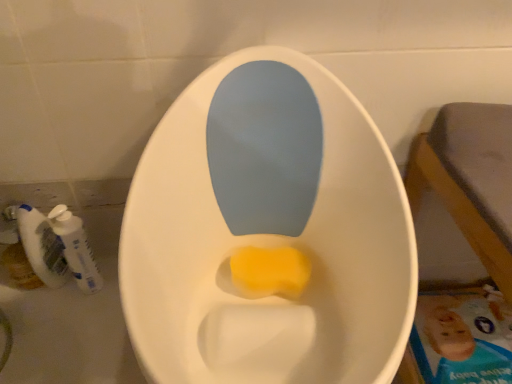
Question: Based on their sizes in the image, would you say white plastic mouthwash at left, the 2th mouthwash when ordered from left to right, is bigger or smaller than yellow sponge at center?

Choices:
 (A) small
 (B) big

Answer: (B)

Question: In the image, is white plastic mouthwash at left, the 2th mouthwash when ordered from left to right, on the left side or the right side of yellow sponge at center?

Choices:
 (A) right
 (B) left

Answer: (B)

Question: Which is nearer to the yellow sponge at center?

Choices:
 (A) white plastic mouthwash at left, which is counted as the first mouthwash, starting from the right
 (B) white plastic mouthwash at lower left, which is counted as the first mouthwash, starting from the left

Answer: (A)

Question: Considering the real-world distances, which object is farthest from the white plastic mouthwash at lower left, which appears as the second mouthwash when viewed from the right?

Choices:
 (A) white plastic mouthwash at left, the 2th mouthwash when ordered from left to right
 (B) yellow sponge at center

Answer: (B)